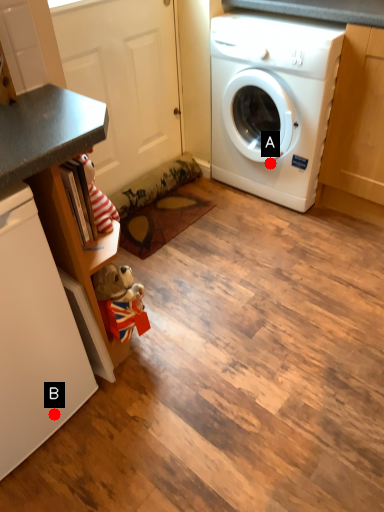
Question: Two points are circled on the image, labeled by A and B beside each circle. Which point is closer to the camera?

Choices:
 (A) A is closer
 (B) B is closer

Answer: (B)